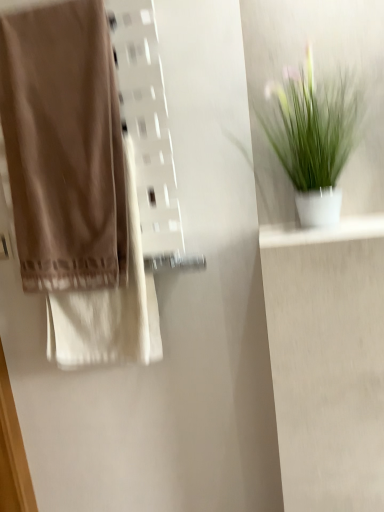
Question: Is the depth of matte brown towel at left greater than that of white glossy shelf at upper right?

Choices:
 (A) yes
 (B) no

Answer: (A)

Question: From a real-world perspective, is matte brown towel at left below white glossy shelf at upper right?

Choices:
 (A) no
 (B) yes

Answer: (A)

Question: Does matte brown towel at left have a lesser height compared to white glossy shelf at upper right?

Choices:
 (A) no
 (B) yes

Answer: (A)

Question: Would you say matte brown towel at left is outside white glossy shelf at upper right?

Choices:
 (A) no
 (B) yes

Answer: (B)

Question: Can you confirm if matte brown towel at left is taller than white glossy shelf at upper right?

Choices:
 (A) yes
 (B) no

Answer: (A)

Question: From the image's perspective, does matte brown towel at left appear higher than white glossy shelf at upper right?

Choices:
 (A) no
 (B) yes

Answer: (B)

Question: Can you confirm if white glossy shelf at upper right is bigger than matte brown towel at left?

Choices:
 (A) no
 (B) yes

Answer: (A)

Question: Does white glossy shelf at upper right have a smaller size compared to matte brown towel at left?

Choices:
 (A) no
 (B) yes

Answer: (B)

Question: Considering the relative sizes of white glossy shelf at upper right and matte brown towel at left in the image provided, is white glossy shelf at upper right taller than matte brown towel at left?

Choices:
 (A) yes
 (B) no

Answer: (B)

Question: Can you confirm if white glossy shelf at upper right is thinner than matte brown towel at left?

Choices:
 (A) no
 (B) yes

Answer: (A)

Question: From a real-world perspective, is white glossy shelf at upper right physically above matte brown towel at left?

Choices:
 (A) yes
 (B) no

Answer: (B)

Question: Are white glossy shelf at upper right and matte brown towel at left beside each other?

Choices:
 (A) yes
 (B) no

Answer: (B)

Question: Can you confirm if green matte plant at upper right is shorter than white glossy shelf at upper right?

Choices:
 (A) yes
 (B) no

Answer: (B)